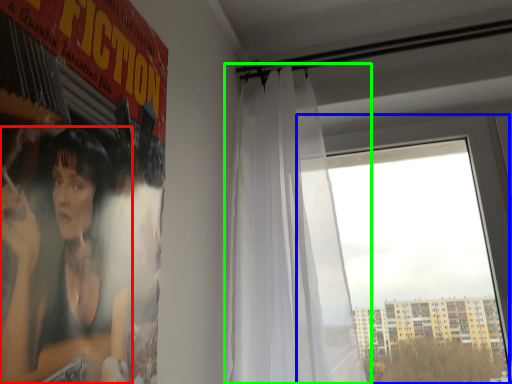
Question: Which is nearer to the person (highlighted by a red box)? window (highlighted by a blue box) or curtain (highlighted by a green box).

Choices:
 (A) window
 (B) curtain

Answer: (B)